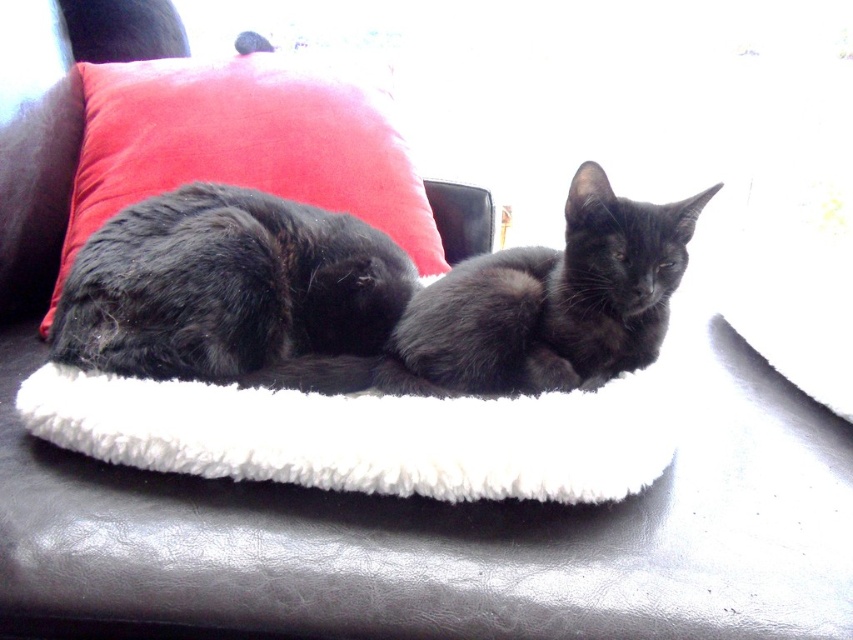
You are a photographer setting up a shoot in this living room. You want to ensure the fluffy black cat at center is visible against the velvet red pillow at upper left. Given their sizes, which object should you adjust the camera focus on to ensure clarity?

The fluffy black cat at center is shorter than the velvet red pillow at upper left. To ensure clarity, focus on the velvet red pillow at upper left since it is taller and will be more prominent in the frame.

You are a photographer setting up a shoot in this living room. You want to place a small lamp between the velvet red pillow at upper left and the black fur cat at center so that it is closer to the pillow than the cat. Given the height difference between them, where should you position the lamp horizontally?

The velvet red pillow at upper left is taller than the black fur cat at center. To place the lamp closer to the pillow than the cat horizontally, position it near the base of the pillow since the pillow is higher up, allowing the lamp to be nearer to the pillow while maintaining a closer horizontal distance.

In the scene shown: You are a photographer standing at a certain distance from the fluffy black cat at center. You want to take a closeup shot of the cat without using a zoom lens. What should you do?

You should move closer to the fluffy black cat at center until you are within 97.36 centimeters to take the closeup shot without using a zoom lens.